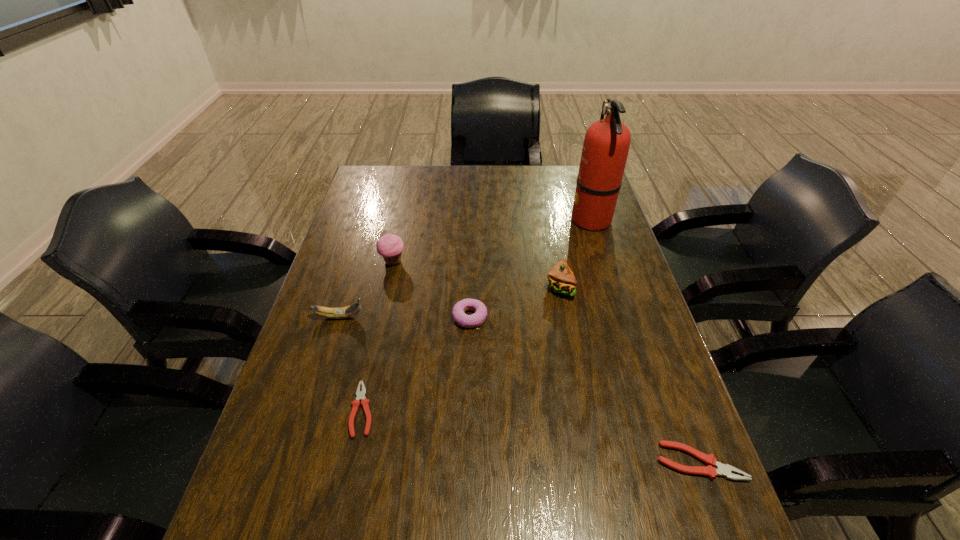
Find the location of `blank area in the image that satisfies the following two spatial constraints: 1. on the back side of the taller pliers; 2. on the side of the farthest object with the nozzle and handle`. blank area in the image that satisfies the following two spatial constraints: 1. on the back side of the taller pliers; 2. on the side of the farthest object with the nozzle and handle is located at coordinates (611, 219).

Identify the location of free space that satisfies the following two spatial constraints: 1. on the peel of the fourth tallest object; 2. on the left side of the left pliers. The width and height of the screenshot is (960, 540). (311, 409).

Locate an element on the screen. The image size is (960, 540). free space that satisfies the following two spatial constraints: 1. on the peel of the banana; 2. on the right side of the taller pliers is located at coordinates (295, 462).